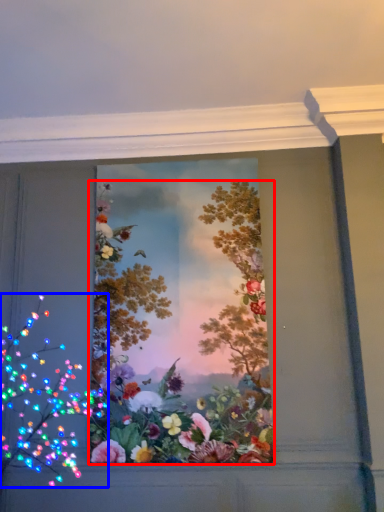
Question: Which object appears closest to the camera in this image, flower (highlighted by a red box) or flower (highlighted by a blue box)?

Choices:
 (A) flower
 (B) flower

Answer: (B)